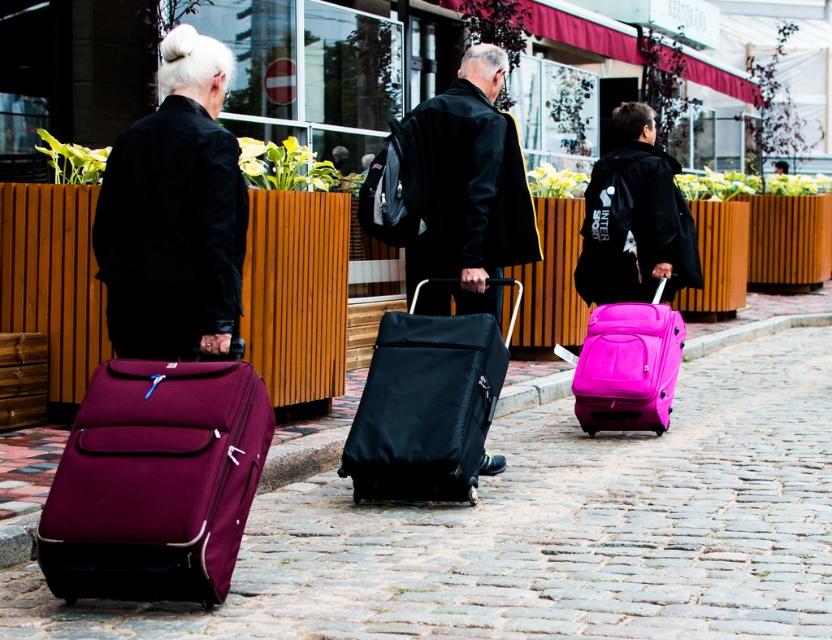
Between marble pavement at center and matte black suitcase at center, which one has less height?

marble pavement at center

What do you see at coordinates (545, 531) in the screenshot?
I see `marble pavement at center` at bounding box center [545, 531].

Is point (669, 474) positioned behind point (481, 248)?

Yes.

Identify the location of marble pavement at center. The image size is (832, 640). (545, 531).

Who is more distant from viewer, [760,564] or [380,333]?

Point [380,333]

Can you confirm if marble pavement at center is thinner than black fabric suitcase at center?

Yes, marble pavement at center is thinner than black fabric suitcase at center.

Is point (265, 506) positioned behind point (372, 449)?

Yes.

Locate an element on the screen. marble pavement at center is located at coordinates (545, 531).

Looking at this image, which is above, marble pavement at center or pink matte suitcase at right?

Positioned higher is pink matte suitcase at right.

Is point (285, 512) positioned after point (632, 385)?

No, it is not.

Who is more forward, (650, 627) or (650, 400)?

Point (650, 627)

What are the coordinates of `marble pavement at center` in the screenshot? It's located at (545, 531).